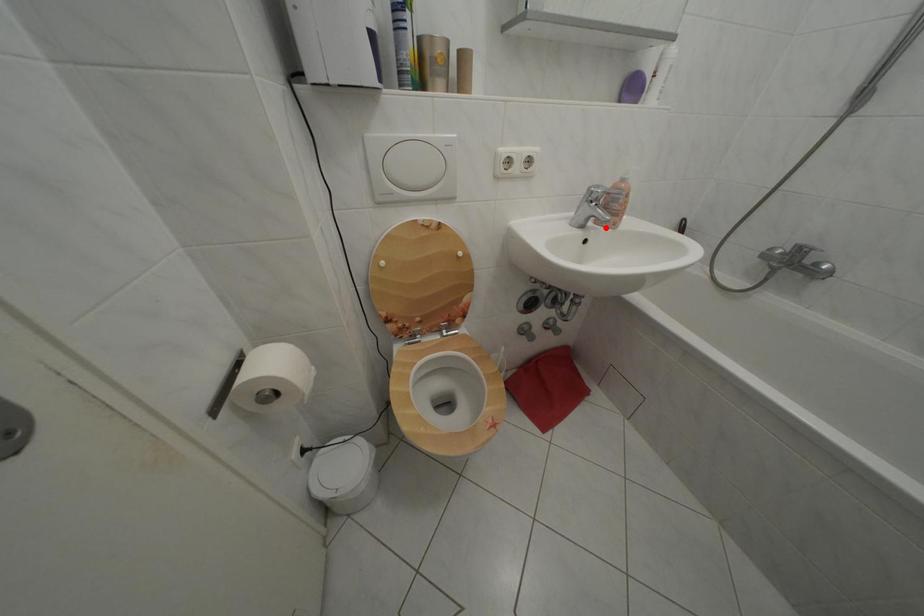
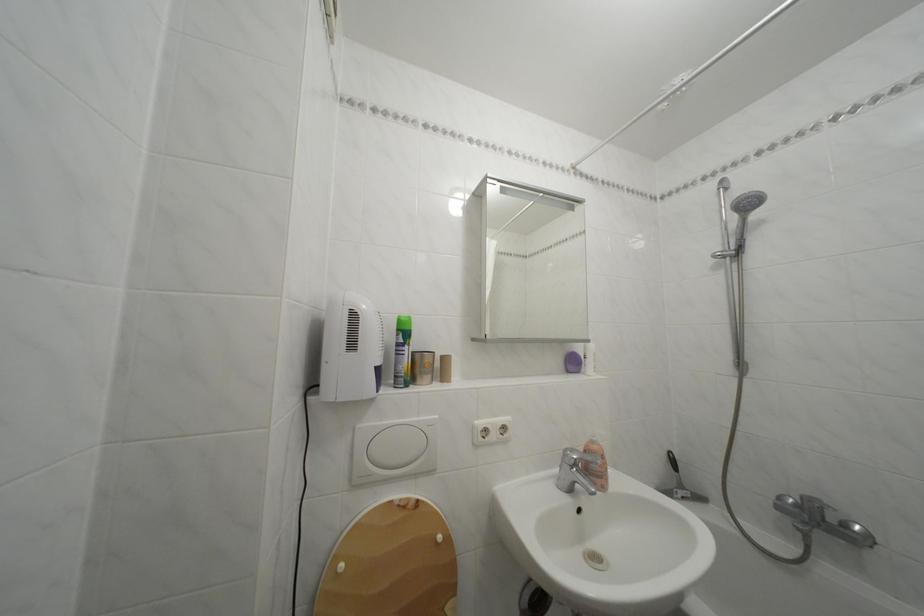
The point at the highlighted location is marked in the first image. Where is the corresponding point in the second image?

(592, 492)